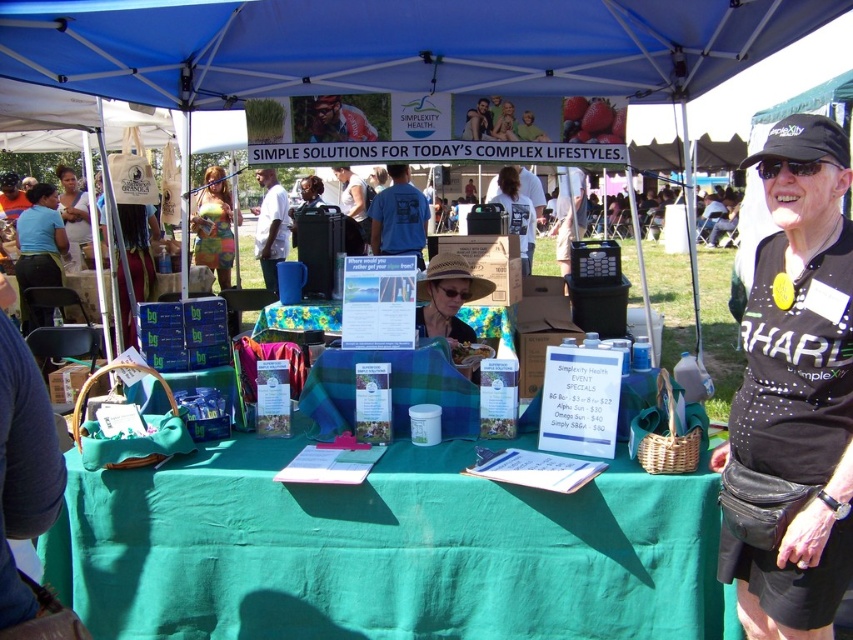
Question: Is matte blue shirt at left wider than matte white shirt at center?

Choices:
 (A) yes
 (B) no

Answer: (A)

Question: Which is nearer to the black matte sunglasses at upper right?

Choices:
 (A) matte black shirt at center
 (B) blue fabric canopy at upper center
 (C) matte white shirt at center

Answer: (B)

Question: Which is farther from the floral fabric tablecloth at center?

Choices:
 (A) matte black laptop at center
 (B) black matte sunglasses at upper right
 (C) multicolored fabric bag at center

Answer: (A)

Question: Can you confirm if multicolored fabric bag at center is positioned below matte white shirt at center?

Choices:
 (A) no
 (B) yes

Answer: (A)

Question: Is matte blue shirt at left bigger than matte black hat at upper center?

Choices:
 (A) no
 (B) yes

Answer: (B)

Question: Which of the following is the closest to the observer?

Choices:
 (A) [x=215, y=253]
 (B) [x=456, y=292]

Answer: (B)